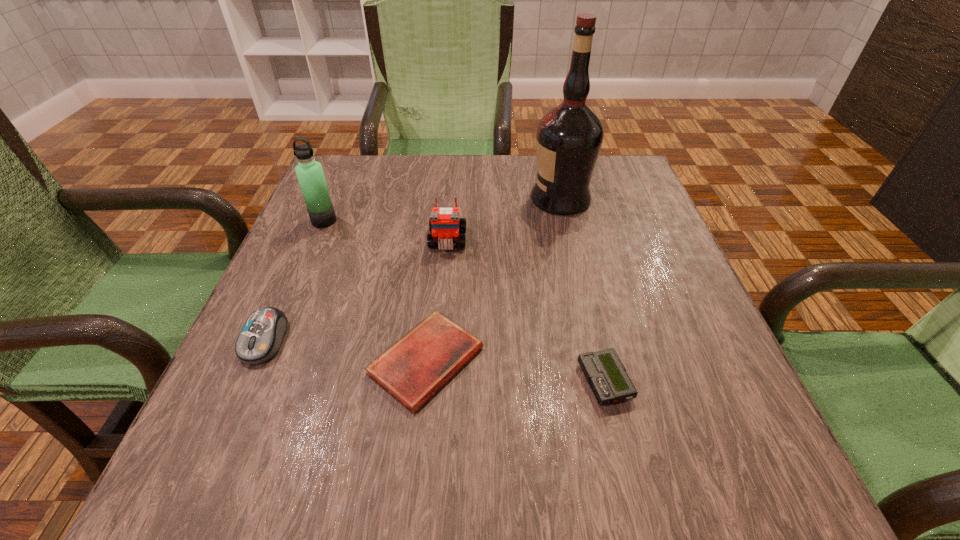
Where is `free spot between the beeper and the shortest object`? The height and width of the screenshot is (540, 960). free spot between the beeper and the shortest object is located at coordinates (516, 372).

What are the coordinates of `free space between the thermos bottle and the Lego` in the screenshot? It's located at (386, 231).

At what (x,y) coordinates should I click in order to perform the action: click on object that ranks as the fourth closest to the tallest object. Please return your answer as a coordinate pair (x, y). Looking at the image, I should click on (309, 172).

Point out which object is positioned as the fourth nearest to the beeper. Please provide its 2D coordinates. Your answer should be formatted as a tuple, i.e. [(x, y)], where the tuple contains the x and y coordinates of a point satisfying the conditions above.

[(261, 337)]

Locate an element on the screen. The height and width of the screenshot is (540, 960). vacant space that satisfies the following two spatial constraints: 1. on the surface of the liquor; 2. on the back side of the fifth tallest object is located at coordinates (603, 382).

Find the location of a particular element. The width and height of the screenshot is (960, 540). free spot that satisfies the following two spatial constraints: 1. on the surface of the tallest object; 2. on the wheel side of the computer mouse is located at coordinates (593, 340).

Locate an element on the screen. The image size is (960, 540). vacant space that satisfies the following two spatial constraints: 1. on the wheel side of the shortest object; 2. on the right side of the computer mouse is located at coordinates (255, 361).